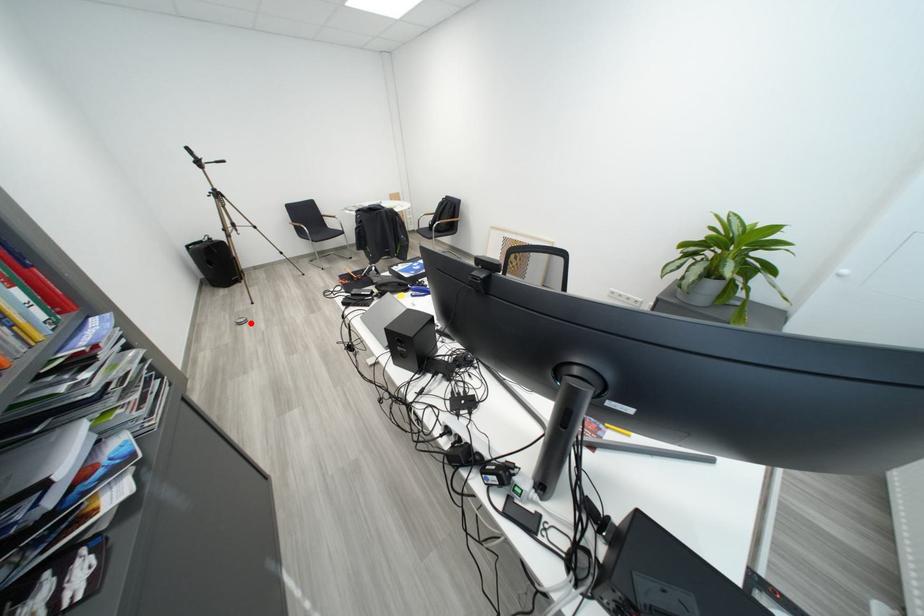
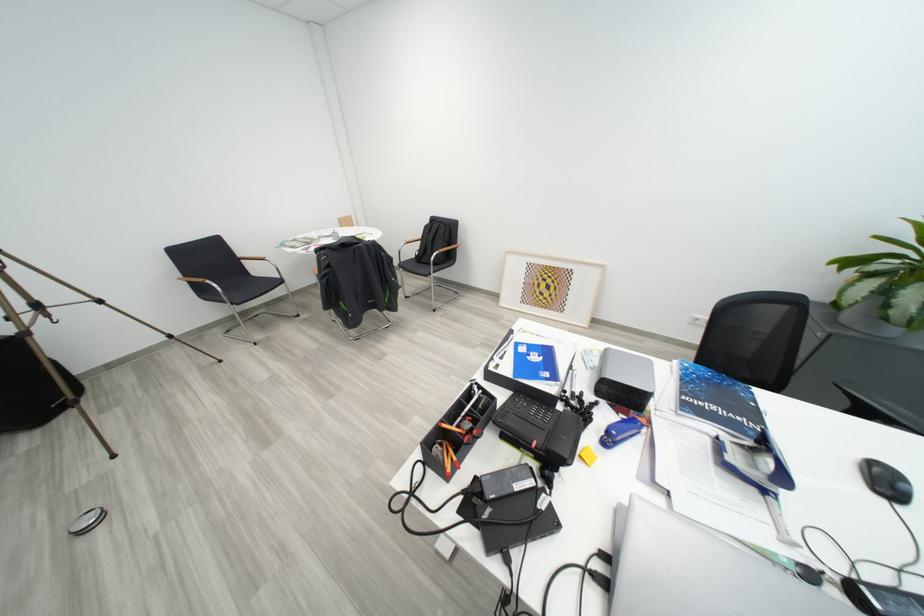
The point at the highlighted location is marked in the first image. Where is the corresponding point in the second image?

(96, 524)